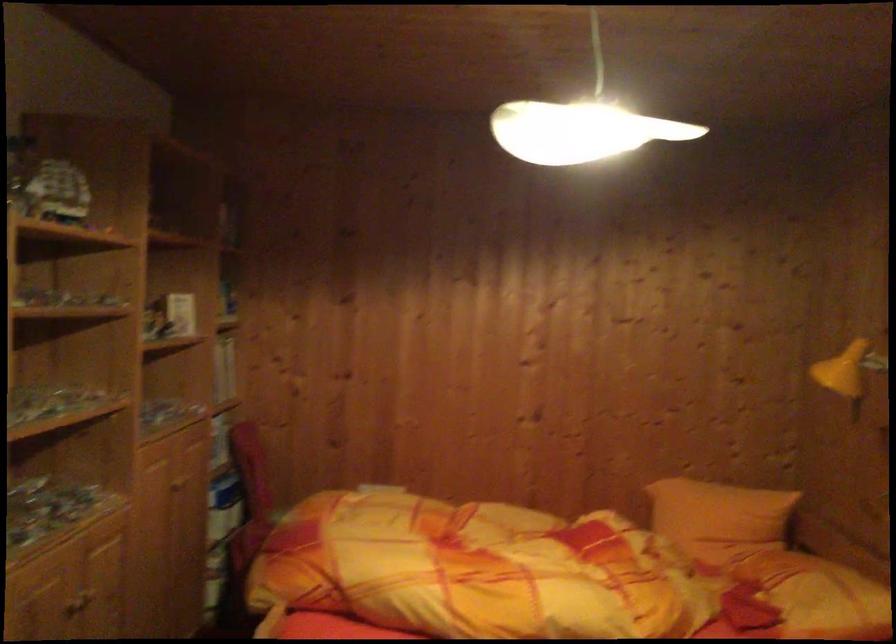
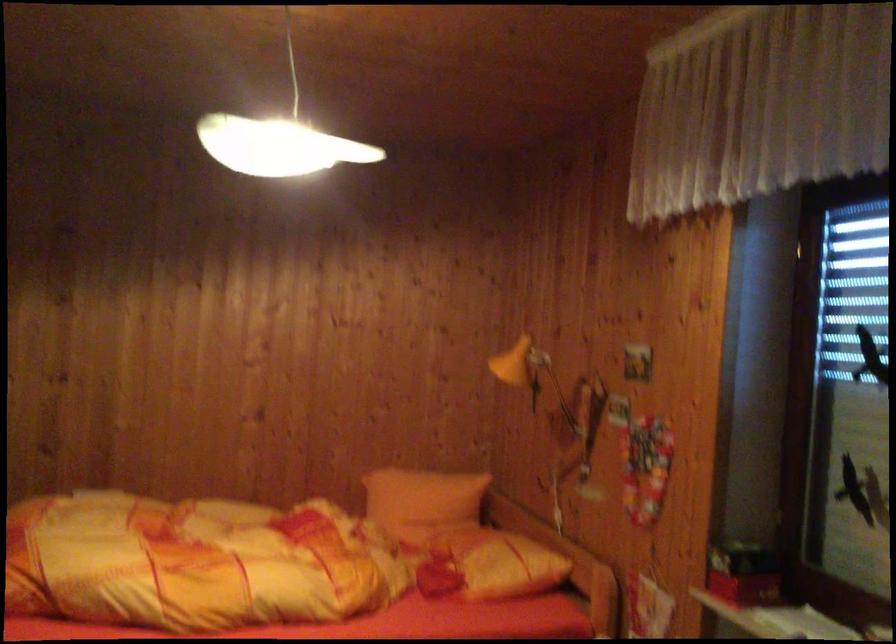
The images are taken continuously from a first-person perspective. In which direction are you moving?

The cameraman moved toward right, backward.